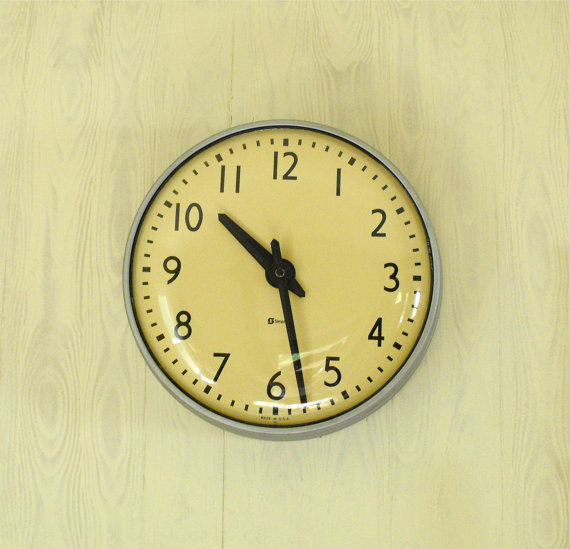
Image resolution: width=570 pixels, height=549 pixels. Find the location of `dingy yellow clock`. dingy yellow clock is located at coordinates (228, 296).